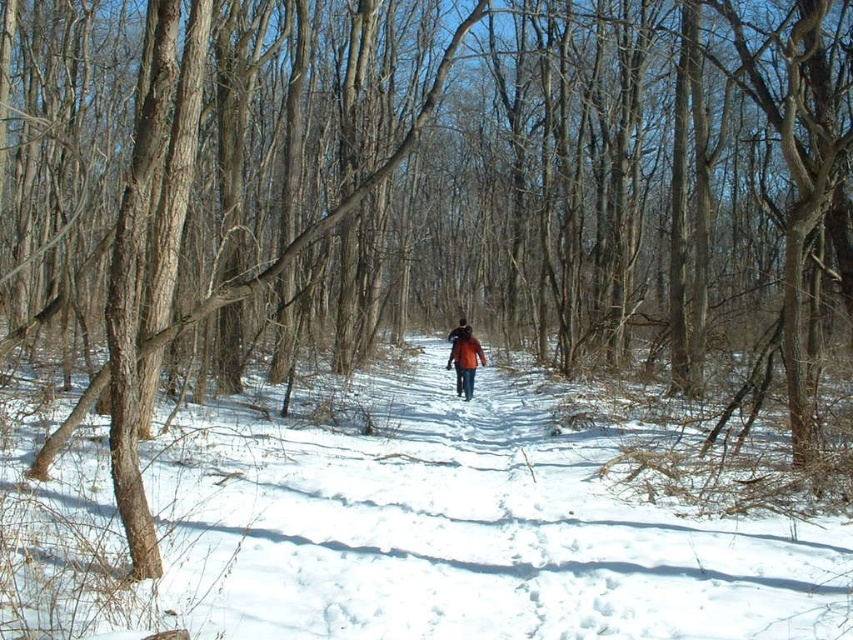
Is white powdery snow at center below orange fabric jacket at center?

Yes.

Between white powdery snow at center and orange fabric jacket at center, which one appears on the left side from the viewer's perspective?

Positioned to the left is white powdery snow at center.

Who is more forward, [265,474] or [477,348]?

Point [265,474]

Identify the location of white powdery snow at center. (398, 531).